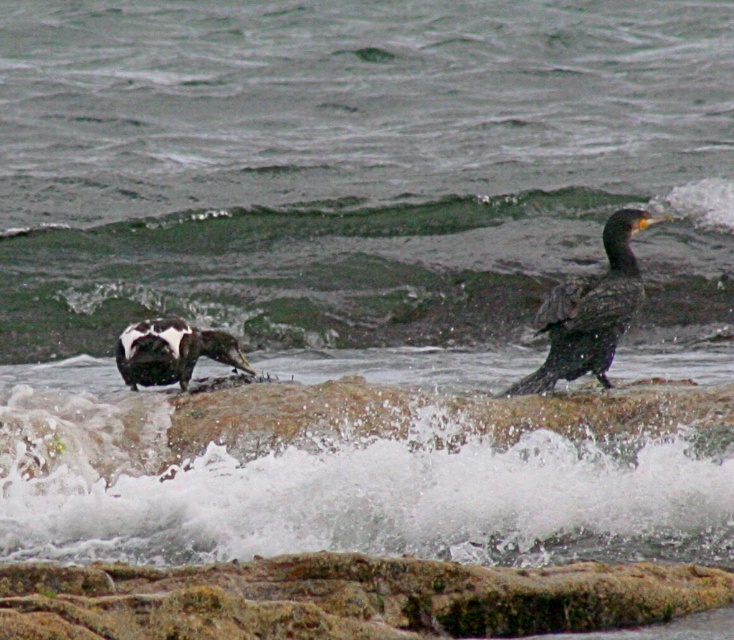
You are standing at the edge of the coastal scene and notice the white frothy water at center and the rusty rock at center. Which object appears to take up more horizontal space in the image?

The white frothy water at center might be wider than rusty rock at center according to the description.